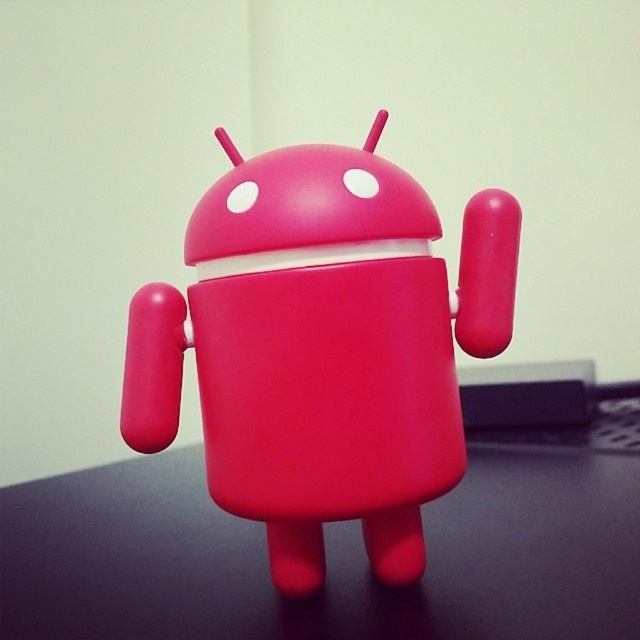
Question: Can you confirm if matte plastic android at center is positioned to the right of rubber-like red table at center?

Choices:
 (A) yes
 (B) no

Answer: (B)

Question: Considering the relative positions of matte plastic android at center and rubber-like red table at center in the image provided, where is matte plastic android at center located with respect to rubber-like red table at center?

Choices:
 (A) above
 (B) below

Answer: (A)

Question: Is matte plastic android at center closer to camera compared to rubber-like red table at center?

Choices:
 (A) yes
 (B) no

Answer: (B)